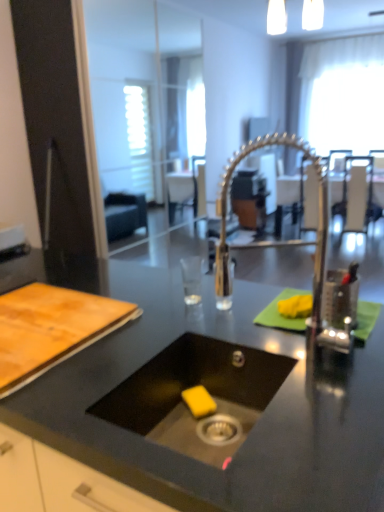
The height and width of the screenshot is (512, 384). I want to click on vacant area that is in front of polished metallic faucet at center, so click(x=317, y=410).